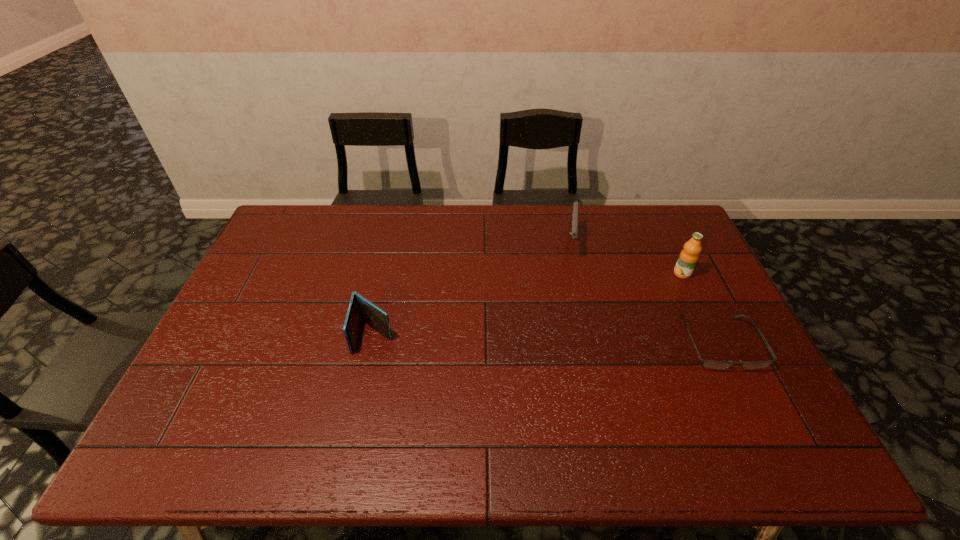
This screenshot has height=540, width=960. In order to click on the leftmost object in this screenshot , I will do `click(359, 309)`.

Where is `spectacles`? Image resolution: width=960 pixels, height=540 pixels. spectacles is located at coordinates (709, 364).

Where is `the second farthest object`? The width and height of the screenshot is (960, 540). the second farthest object is located at coordinates 688,258.

Image resolution: width=960 pixels, height=540 pixels. Identify the location of orange juice. (688, 258).

Identify the location of the farthest object. (573, 227).

Find the location of a particular element. pistol is located at coordinates (573, 227).

Where is `vacant position located 0.120m on the exterior surface of the leftmost object`? vacant position located 0.120m on the exterior surface of the leftmost object is located at coordinates (362, 394).

The image size is (960, 540). I want to click on vacant space located on the front-facing side of the shortest object, so click(744, 394).

Identify the location of free space located on the label of the orange juice. (617, 303).

This screenshot has width=960, height=540. I want to click on free space located on the label of the orange juice, so click(581, 320).